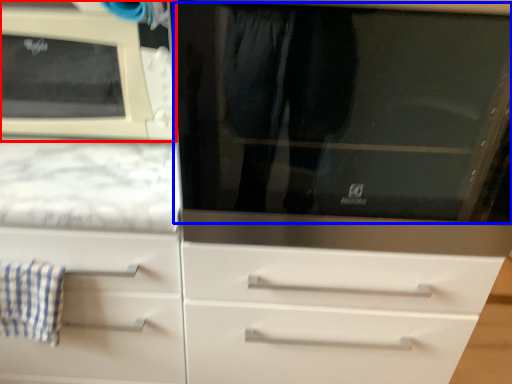
Question: Among these objects, which one is nearest to the camera, microwave oven (highlighted by a red box) or glass door (highlighted by a blue box)?

Choices:
 (A) microwave oven
 (B) glass door

Answer: (B)